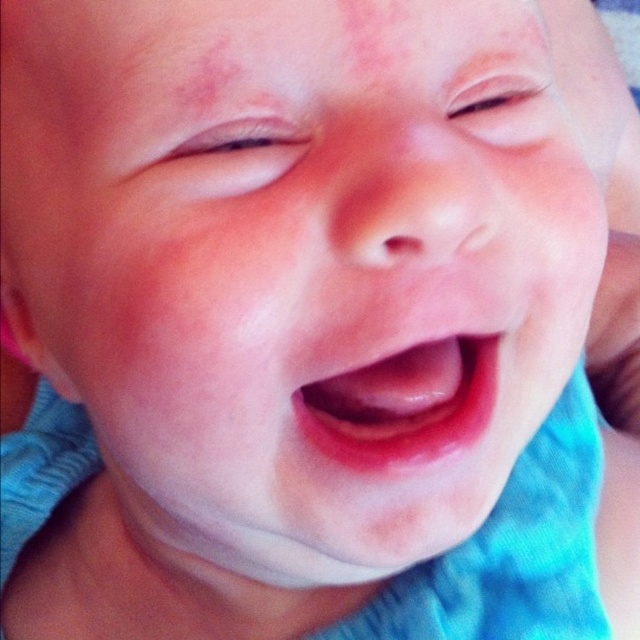
Question: Is pink glossy lips at center positioned behind pink smooth skin at upper left?

Choices:
 (A) no
 (B) yes

Answer: (B)

Question: Does pink smooth skin at upper center appear under pink smooth freckle at upper left?

Choices:
 (A) no
 (B) yes

Answer: (A)

Question: Which point is closer to the camera?

Choices:
 (A) (193, 109)
 (B) (456, 104)

Answer: (A)

Question: Can you confirm if pink smooth skin at upper left is positioned above pink smooth freckle at upper left?

Choices:
 (A) yes
 (B) no

Answer: (B)

Question: Which object is the closest to the pink glossy lips at center?

Choices:
 (A) pink smooth freckle at upper left
 (B) pink smooth skin at upper left
 (C) pink smooth skin at upper center

Answer: (B)

Question: Which of the following is the farthest from the observer?

Choices:
 (A) pink smooth freckle at upper left
 (B) pink glossy lips at center

Answer: (B)